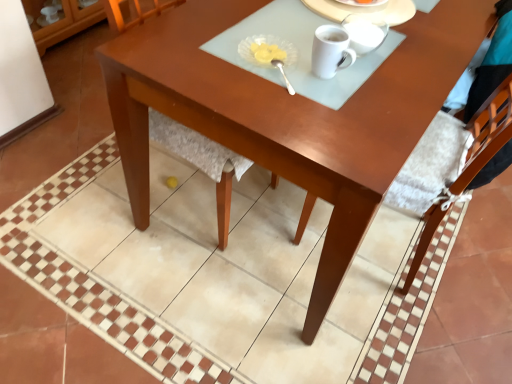
This screenshot has width=512, height=384. What are the coordinates of `free point behind silver metallic spoon at center, which appears as the fourth tableware when viewed from the top` in the screenshot? It's located at (274, 39).